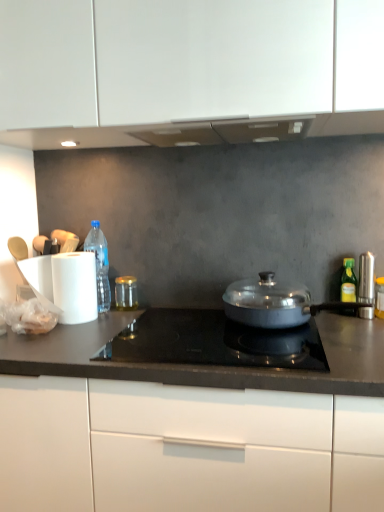
Where is `vacant region to the left of satin silver canister at right`? The height and width of the screenshot is (512, 384). vacant region to the left of satin silver canister at right is located at coordinates (332, 321).